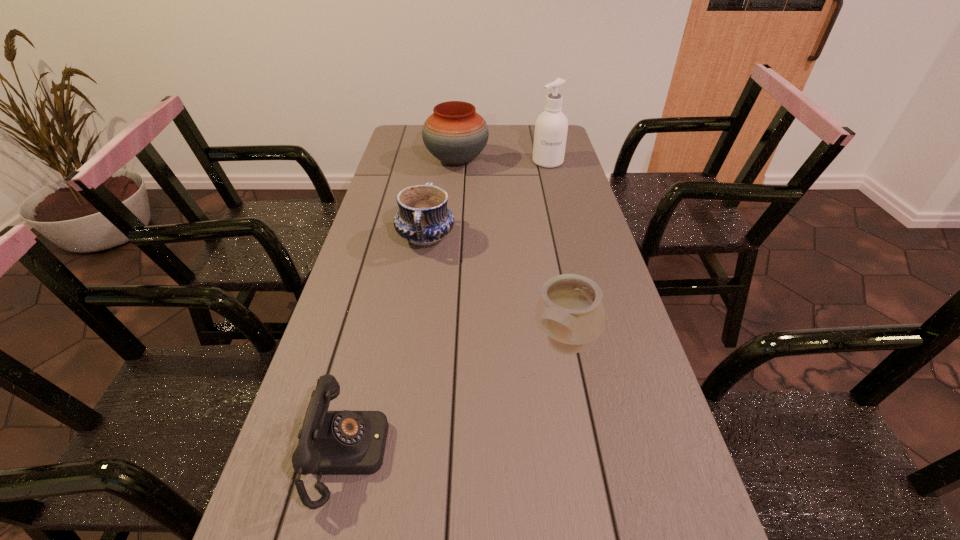
Find the location of a particular element. This screenshot has height=540, width=960. free region located 0.120m on the front of the nearest pottery is located at coordinates (582, 431).

Find the location of a particular element. The image size is (960, 540). free location located 0.110m on the left of the third nearest object is located at coordinates (360, 239).

Image resolution: width=960 pixels, height=540 pixels. What are the coordinates of `vacant region located 0.330m on the dial of the shortest object` in the screenshot? It's located at coord(563,454).

You are a GUI agent. You are given a task and a screenshot of the screen. Output one action in this format:
    pyautogui.click(x=<x>, y=<y>)
    Task: Click on the object that is at the far edge
    This screenshot has height=540, width=960.
    Given the screenshot: What is the action you would take?
    pyautogui.click(x=455, y=134)

Find the location of a particular element. telephone present at the left edge is located at coordinates (345, 442).

Locate an element on the screen. This screenshot has width=960, height=540. cleansing agent located at the right edge is located at coordinates (551, 127).

In order to click on pottery at the right edge in this screenshot , I will do `click(570, 311)`.

You are a GUI agent. You are given a task and a screenshot of the screen. Output one action in this format:
    pyautogui.click(x=<x>, y=<y>)
    Task: Click on the object that is at the far left corner
    
    Given the screenshot: What is the action you would take?
    pyautogui.click(x=455, y=134)

In the image, there is a desktop. Identify the location of vacant space at the left edge. (301, 505).

What are the coordinates of `vacant space at the right edge of the desktop` in the screenshot? It's located at (684, 475).